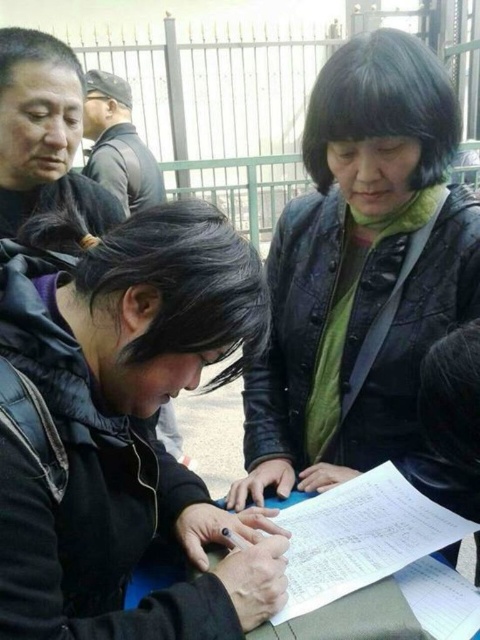
Question: Does black leather jacket at lower left appear on the left side of black leather jacket at upper center?

Choices:
 (A) yes
 (B) no

Answer: (A)

Question: Can you confirm if black leather jacket at upper center is thinner than white paper at center?

Choices:
 (A) yes
 (B) no

Answer: (B)

Question: Which object is farther from the camera taking this photo?

Choices:
 (A) black leather jacket at lower left
 (B) black leather jacket at upper center

Answer: (B)

Question: Which point is farther to the camera?

Choices:
 (A) black leather jacket at lower left
 (B) white paper at center
 (C) black leather jacket at upper center

Answer: (C)

Question: Which of the following is the farthest from the observer?

Choices:
 (A) (170, 316)
 (B) (301, 392)

Answer: (B)

Question: Can you confirm if black leather jacket at upper center is positioned to the right of white paper at center?

Choices:
 (A) yes
 (B) no

Answer: (A)